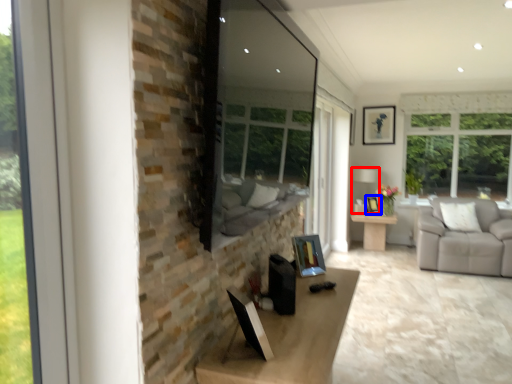
Question: Which object appears closest to the camera in this image, lamp (highlighted by a red box) or picture frame (highlighted by a blue box)?

Choices:
 (A) lamp
 (B) picture frame

Answer: (A)